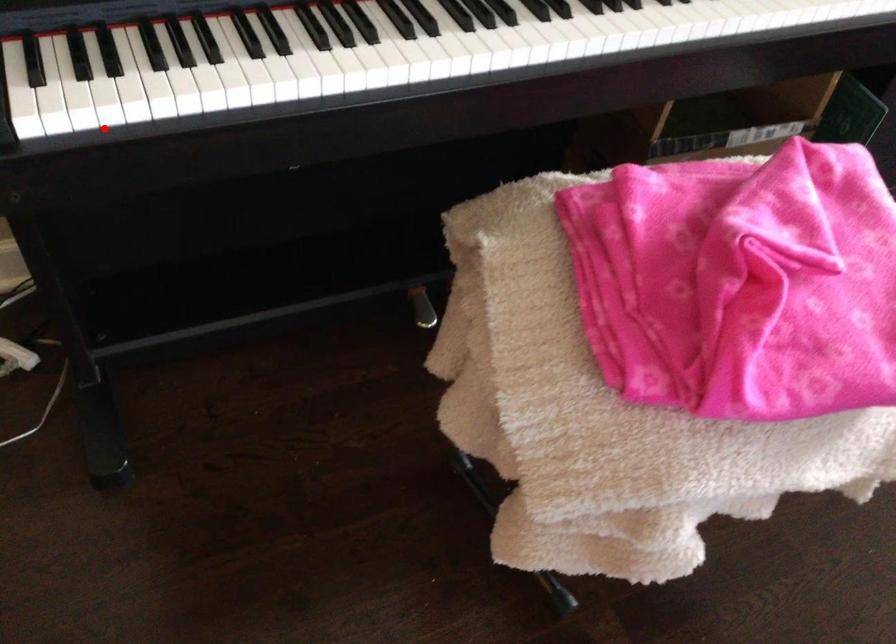
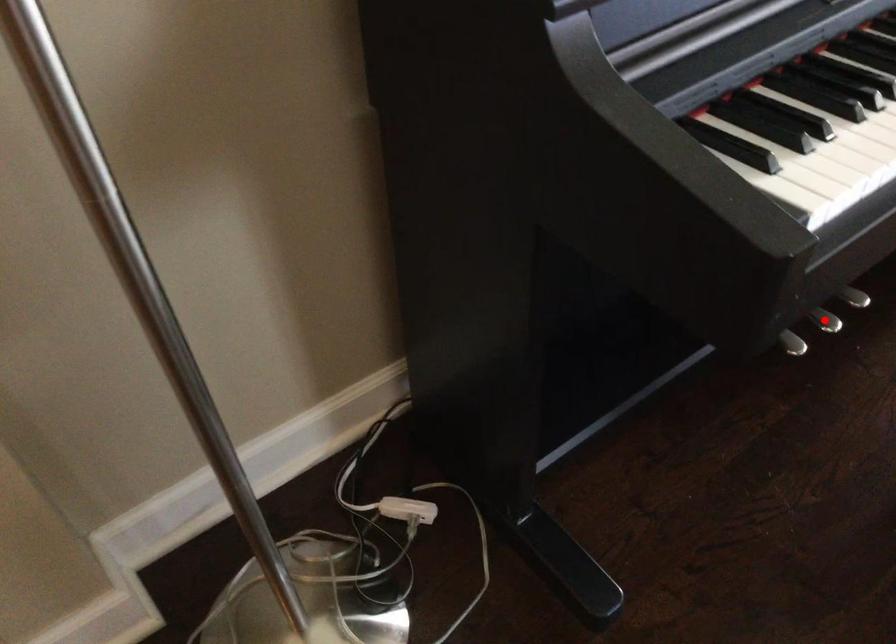
I am providing you with two images of the same scene from different viewpoints. A red point is marked on the first image and another point is marked on the second image. Is the red point in image1 aligned with the point shown in image2?

No